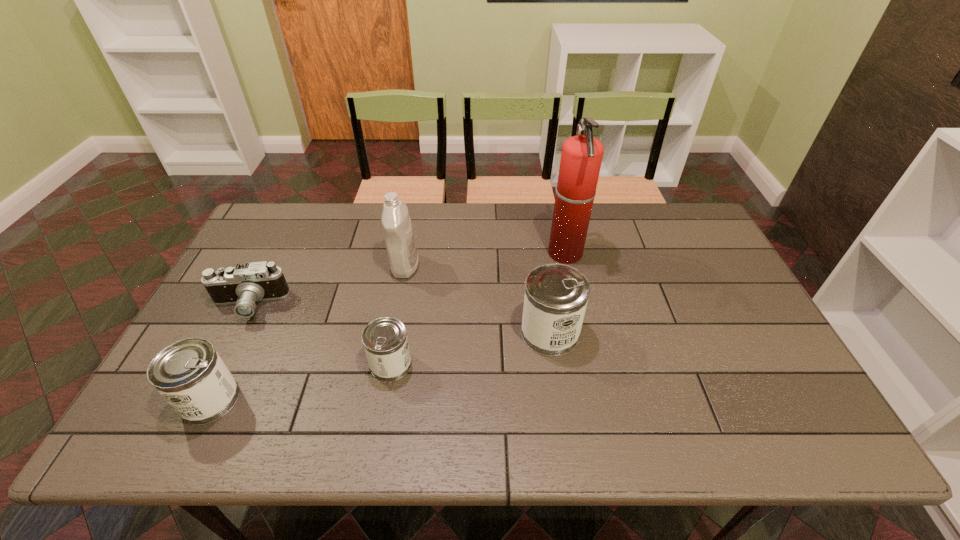
The width and height of the screenshot is (960, 540). I want to click on free point between the shortest can and the camera, so coord(320,335).

Locate an element on the screen. The width and height of the screenshot is (960, 540). object that stands as the closest to the fire extinguisher is located at coordinates (556, 295).

Locate an element on the screen. Image resolution: width=960 pixels, height=540 pixels. object that is the fifth closest to the tallest object is located at coordinates (191, 376).

Identify the location of can that is the third nearest to the tallest object. The height and width of the screenshot is (540, 960). (191, 376).

Image resolution: width=960 pixels, height=540 pixels. I want to click on the closest can to the detergent, so click(385, 341).

Locate an element on the screen. The width and height of the screenshot is (960, 540). vacant space that satisfies the following two spatial constraints: 1. at the lens of the second can from left to right; 2. on the left side of the camera is located at coordinates (219, 364).

The image size is (960, 540). Find the location of `blank space that satisfies the following two spatial constraints: 1. on the back side of the second can from right to left; 2. on the right side of the second tallest can`. blank space that satisfies the following two spatial constraints: 1. on the back side of the second can from right to left; 2. on the right side of the second tallest can is located at coordinates (228, 364).

Find the location of a particular element. This screenshot has width=960, height=540. vacant region that satisfies the following two spatial constraints: 1. on the front side of the detergent; 2. on the left side of the fourth shortest object is located at coordinates (393, 333).